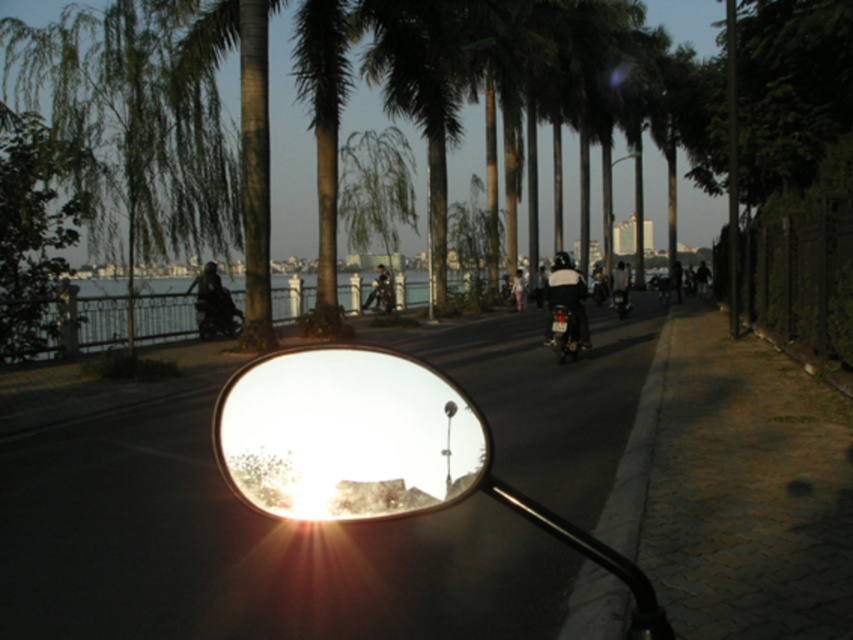
From the picture: You are a photographer standing in the street scene. You want to take a photo of the metallic silver motorcycle at center and the green leafy tree at center. Based on their positions, will the tree appear in the reflection of the motorcycle side mirror?

The green leafy tree at center is above the metallic silver motorcycle at center, so it is likely visible in the reflection of the motorcycle side mirror since it is positioned above the motorcycle.

You are a photographer trying to capture a photo of both the green textured palm tree at center and the black matte motorcycle at center from your current position. Which object will appear larger in the photo?

The green textured palm tree at center will appear larger in the photo because it is much taller than the black matte motorcycle at center.

You are planning to park your car near the black matte motorcycle at center. Based on the scene description, can you determine if there is enough space between the motorcycle and the railing along the water edge to safely park your car?

The black matte motorcycle at center is located at point [567,296]. Since the railing is along the water edge on the other side of the road, there should be sufficient space between them to park your car safely.